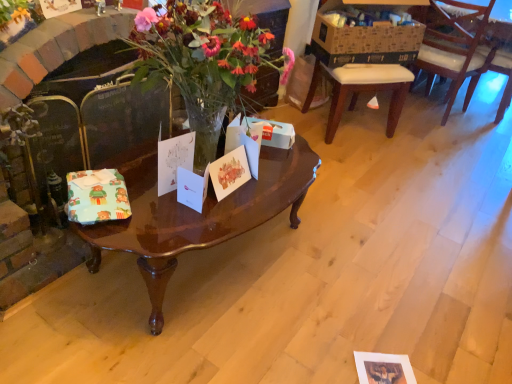
At what (x,y) coordinates should I click in order to perform the action: click on vacant space that is to the left of white paper gift card at center, arranged as the third gift card when viewed from the right. Please return your answer as a coordinate pair (x, y). Looking at the image, I should click on (136, 173).